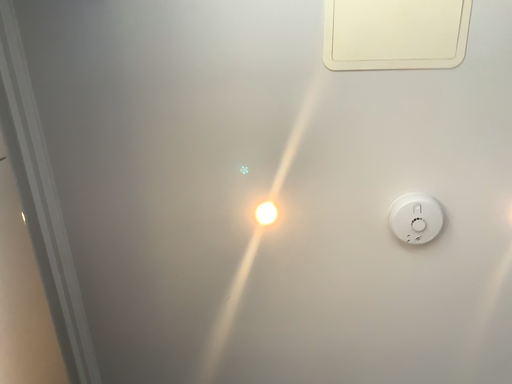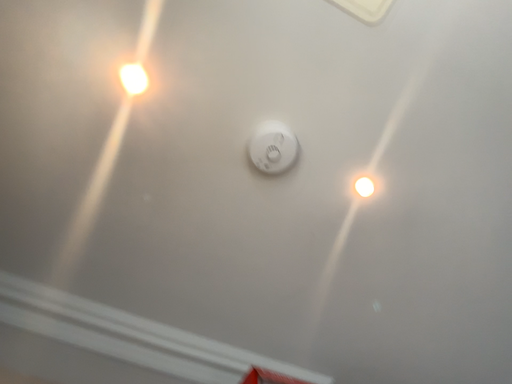
Question: How did the camera likely rotate when shooting the video?

Choices:
 (A) rotated downward
 (B) rotated upward

Answer: (A)